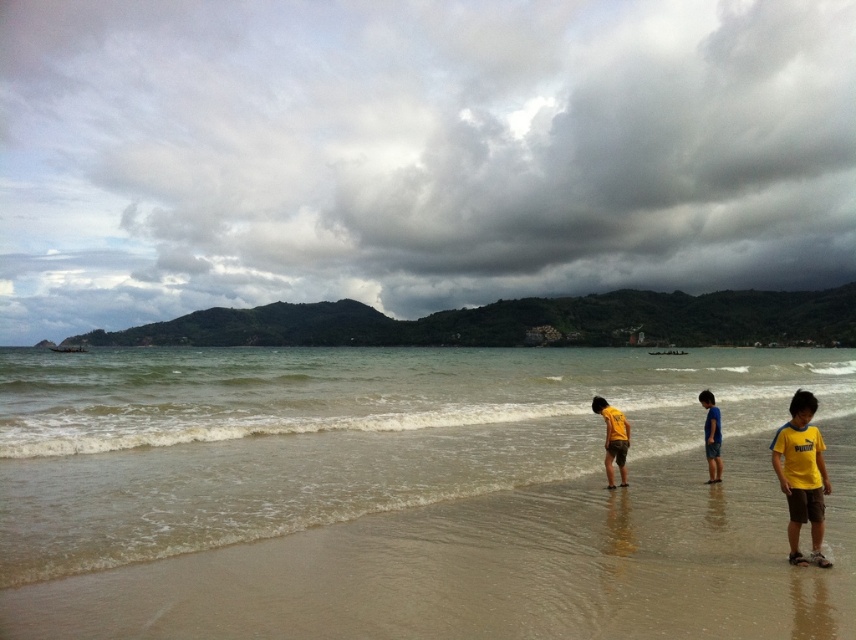
You are standing at the point with coordinates point (801, 476) and want to walk towards the yellow cotton shirt at lower right. Which direction should you face to move directly towards it?

Since the yellow cotton shirt at lower right is located at point (801, 476), you are already at that position. Therefore, you don not need to move in any direction to reach it.

You are a photographer trying to capture the children in the scene. You want to ensure that both the yellow cotton shirt at lower right and the blue cotton shorts at lower right are visible in the frame. Based on their positions, which clothing item should you focus on first to ensure both are in the shot?

The yellow cotton shirt at lower right is to the right of the blue cotton shorts at lower right. To capture both in the frame, focus on positioning the camera so that the yellow cotton shirt at lower right is on the right side of the frame and the blue cotton shorts at lower right are on the left side, ensuring both are visible.

You are a photographer standing at the point marked by the coordinates point (613, 438). You want to take a picture of the yellow matte shirt at center. Which direction should you face to capture it in your shot?

The point (613, 438) indicates the yellow matte shirt at center, so you are already facing the correct direction to capture it in your shot.